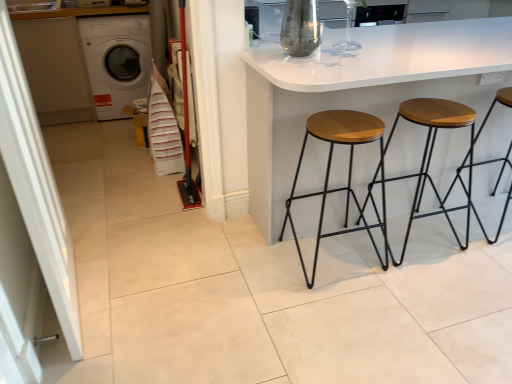
Find the location of a particular element. vacant region to the left of woodenmaterial/texturestool at center, the 1th stool from the left is located at coordinates (257, 264).